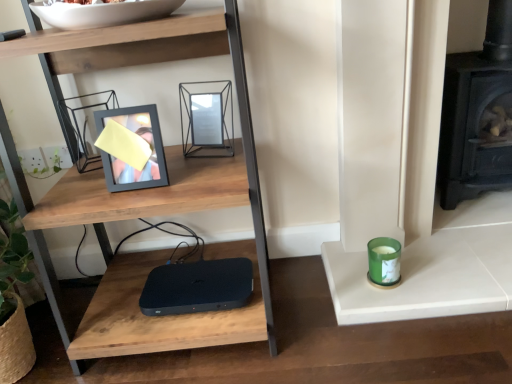
Measure the distance between black matte router at center and camera.

black matte router at center and camera are 1.20 meters apart.

Locate an element on the screen. matte black picture frame at upper left, marked as the first picture frame in a left-to-right arrangement is located at coordinates (145, 142).

Where is `white glossy bowl at upper center`? white glossy bowl at upper center is located at coordinates (103, 13).

Starting from the black matte router at center, which picture frame is the 2nd one in front? Please provide its 2D coordinates.

[(145, 142)]

Is black matte router at center closer to camera compared to matte black picture frame at upper left, marked as the first picture frame in a left-to-right arrangement?

No, black matte router at center is further to the viewer.

Is black matte router at center inside or outside of matte black picture frame at upper left, which appears as the second picture frame when viewed from the right?

black matte router at center is not enclosed by matte black picture frame at upper left, which appears as the second picture frame when viewed from the right.

Choose the correct answer: Is black cast iron fireplace at right inside metallic geometric frame at upper center, which is the 2th picture frame in left-to-right order, or outside it?

black cast iron fireplace at right is outside metallic geometric frame at upper center, which is the 2th picture frame in left-to-right order.

From the image's perspective, is black cast iron fireplace at right positioned above or below metallic geometric frame at upper center, acting as the 1th picture frame starting from the right?

Based on their image positions, black cast iron fireplace at right is located above metallic geometric frame at upper center, acting as the 1th picture frame starting from the right.

Is black cast iron fireplace at right at the right side of metallic geometric frame at upper center, acting as the 1th picture frame starting from the right?

Yes, black cast iron fireplace at right is to the right of metallic geometric frame at upper center, acting as the 1th picture frame starting from the right.

Is woodenmaterial/textureshelf at center placed right next to metallic geometric frame at upper center, acting as the 1th picture frame starting from the right?

No, woodenmaterial/textureshelf at center is not beside metallic geometric frame at upper center, acting as the 1th picture frame starting from the right.

Which of these two, woodenmaterial/textureshelf at center or metallic geometric frame at upper center, which is the 2th picture frame in left-to-right order, stands shorter?

Standing shorter between the two is metallic geometric frame at upper center, which is the 2th picture frame in left-to-right order.

From the image's perspective, would you say woodenmaterial/textureshelf at center is shown under metallic geometric frame at upper center, acting as the 1th picture frame starting from the right?

Indeed, from the image's perspective, woodenmaterial/textureshelf at center is shown beneath metallic geometric frame at upper center, acting as the 1th picture frame starting from the right.

Which is closer, [57,220] or [183,139]?

Point [57,220].

How different are the orientations of woodenmaterial/textureshelf at center and white glossy bowl at upper center in degrees?

They differ by 0.000481 degrees in their facing directions.

Would you say woodenmaterial/textureshelf at center contains white glossy bowl at upper center?

Yes, white glossy bowl at upper center is surrounded by woodenmaterial/textureshelf at center.

Is woodenmaterial/textureshelf at center aimed at white glossy bowl at upper center?

No, woodenmaterial/textureshelf at center is not oriented towards white glossy bowl at upper center.

Can you confirm if woodenmaterial/textureshelf at center is positioned to the right of white glossy bowl at upper center?

Correct, you'll find woodenmaterial/textureshelf at center to the right of white glossy bowl at upper center.

Which is in front, point (88, 5) or point (246, 147)?

The point (88, 5) is closer to the camera.

From the image's perspective, is white glossy bowl at upper center located beneath woodenmaterial/textureshelf at center?

No, from the image's perspective, white glossy bowl at upper center is not below woodenmaterial/textureshelf at center.

Visually, is white glossy bowl at upper center positioned to the left or to the right of woodenmaterial/textureshelf at center?

white glossy bowl at upper center is positioned on woodenmaterial/textureshelf at center's left side.

Can you confirm if white glossy bowl at upper center is wider than woodenmaterial/textureshelf at center?

No, white glossy bowl at upper center is not wider than woodenmaterial/textureshelf at center.

Is black cast iron fireplace at right with matte black picture frame at upper left, marked as the first picture frame in a left-to-right arrangement?

black cast iron fireplace at right is not next to matte black picture frame at upper left, marked as the first picture frame in a left-to-right arrangement, and they're not touching.

Is black cast iron fireplace at right aimed at matte black picture frame at upper left, which appears as the second picture frame when viewed from the right?

No, black cast iron fireplace at right is not oriented towards matte black picture frame at upper left, which appears as the second picture frame when viewed from the right.

From a real-world perspective, is black cast iron fireplace at right on matte black picture frame at upper left, which appears as the second picture frame when viewed from the right?

No.

The height and width of the screenshot is (384, 512). Identify the location of fireplace that is above the matte black picture frame at upper left, marked as the first picture frame in a left-to-right arrangement (from the image's perspective). (478, 114).

From a real-world perspective, is green glass candle at right located higher than black matte router at center?

No.

Is green glass candle at right to the right of black matte router at center from the viewer's perspective?

Indeed, green glass candle at right is positioned on the right side of black matte router at center.

Locate an element on the screen. candle holder directly beneath the black matte router at center (from a real-world perspective) is located at coordinates (384, 261).

Find the location of a particular element. This screenshot has width=512, height=384. the 2nd picture frame in front of the black matte router at center is located at coordinates (145, 142).

The image size is (512, 384). What are the coordinates of `fireplace above the metallic geometric frame at upper center, acting as the 1th picture frame starting from the right (from the image's perspective)` in the screenshot? It's located at (478, 114).

Based on their spatial positions, is white glossy bowl at upper center or woodenmaterial/textureshelf at center closer to metallic geometric frame at upper center, which is the 2th picture frame in left-to-right order?

The object closer to metallic geometric frame at upper center, which is the 2th picture frame in left-to-right order, is woodenmaterial/textureshelf at center.

From the image, which object appears to be nearer to metallic geometric frame at upper center, which is the 2th picture frame in left-to-right order, green glass candle at right or black cast iron fireplace at right?

green glass candle at right.

Considering their positions, is black cast iron fireplace at right positioned closer to green glass candle at right than white glossy bowl at upper center?

The object closer to green glass candle at right is black cast iron fireplace at right.

Estimate the real-world distances between objects in this image. Which object is further from white glossy bowl at upper center, black cast iron fireplace at right or metallic geometric frame at upper center, which is the 2th picture frame in left-to-right order?

black cast iron fireplace at right is positioned further to the anchor white glossy bowl at upper center.

From the image, which object appears to be nearer to black cast iron fireplace at right, matte black picture frame at upper left, marked as the first picture frame in a left-to-right arrangement, or black matte router at center?

black matte router at center is positioned closer to the anchor black cast iron fireplace at right.

Considering their positions, is green glass candle at right positioned further to black matte router at center than woodenmaterial/textureshelf at center?

green glass candle at right is positioned further to the anchor black matte router at center.

From the picture: When comparing their distances from metallic geometric frame at upper center, which is the 2th picture frame in left-to-right order, does white glossy bowl at upper center or green glass candle at right seem further?

green glass candle at right lies further to metallic geometric frame at upper center, which is the 2th picture frame in left-to-right order, than the other object.

When comparing their distances from black matte router at center, does black cast iron fireplace at right or matte black picture frame at upper left, marked as the first picture frame in a left-to-right arrangement, seem closer?

Based on the image, matte black picture frame at upper left, marked as the first picture frame in a left-to-right arrangement, appears to be nearer to black matte router at center.

Locate an element on the screen. Image resolution: width=512 pixels, height=384 pixels. computer located between matte black picture frame at upper left, which appears as the second picture frame when viewed from the right, and black cast iron fireplace at right in the left-right direction is located at coordinates (197, 287).

The height and width of the screenshot is (384, 512). What are the coordinates of `candle holder situated between white glossy bowl at upper center and black cast iron fireplace at right from left to right` in the screenshot? It's located at (384, 261).

I want to click on candle holder between matte black picture frame at upper left, marked as the first picture frame in a left-to-right arrangement, and black cast iron fireplace at right, in the horizontal direction, so click(384, 261).

Where is `shelf between matte black picture frame at upper left, which appears as the second picture frame when viewed from the right, and black cast iron fireplace at right`? The width and height of the screenshot is (512, 384). shelf between matte black picture frame at upper left, which appears as the second picture frame when viewed from the right, and black cast iron fireplace at right is located at coordinates (165, 147).